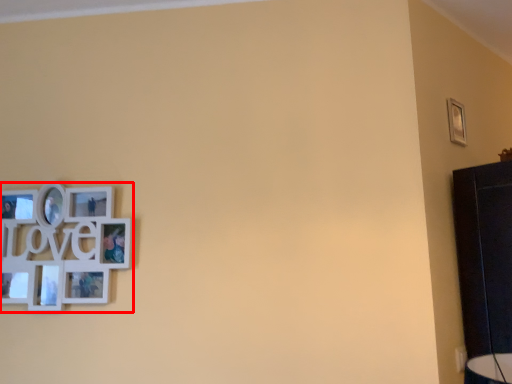
Question: Where is picture frame (annotated by the red box) located in relation to picture frame in the image?

Choices:
 (A) left
 (B) right

Answer: (A)